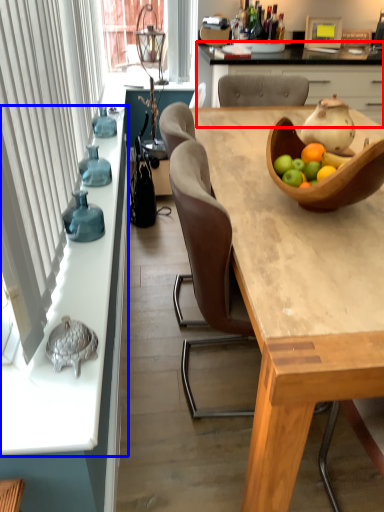
Question: Which object is closer to the camera taking this photo, cabinetry (highlighted by a red box) or countertop (highlighted by a blue box)?

Choices:
 (A) cabinetry
 (B) countertop

Answer: (B)